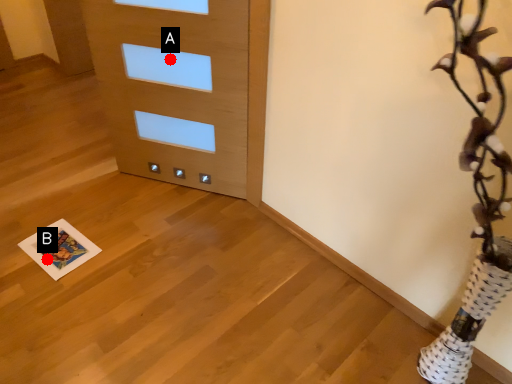
Question: Two points are circled on the image, labeled by A and B beside each circle. Among these points, which one is nearest to the camera?

Choices:
 (A) A is closer
 (B) B is closer

Answer: (B)